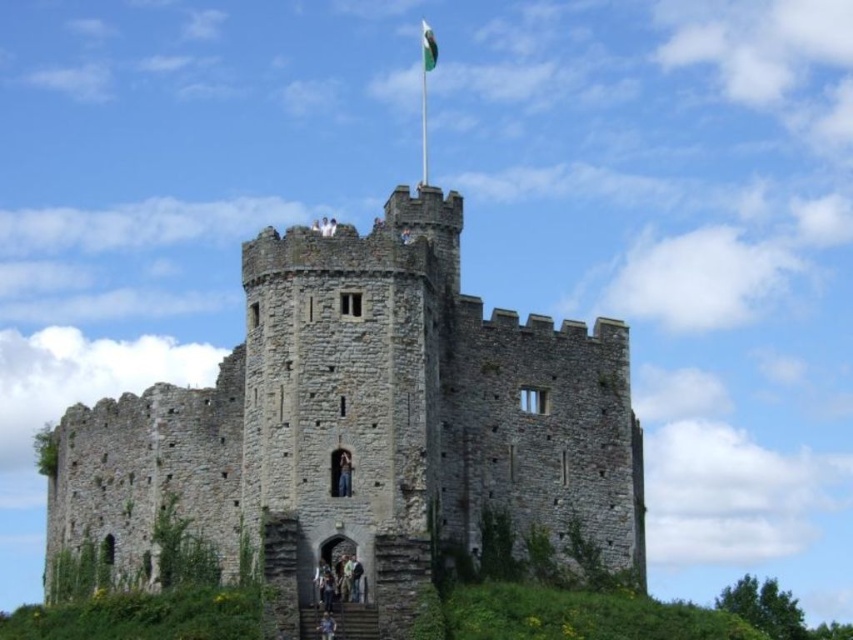
You are a tourist visiting the historic gray stone castle at center and notice the green fabric flag at upper center flying above it. Considering their sizes, which object would cast a bigger shadow on the ground?

The gray stone castle at center has a larger size compared to the green fabric flag at upper center, so it would cast a bigger shadow on the ground.

You are a visitor standing at the base of the gray stone castle at center. You want to take a photo of the green fabric flag at upper center. Can you see the entire flagpole and flag without any obstruction from the castle?

The gray stone castle at center is taller than the green fabric flag at upper center, so the castle might block part of the flagpole and flag, making it difficult to capture the entire flagpole and flag in one photo without obstruction.